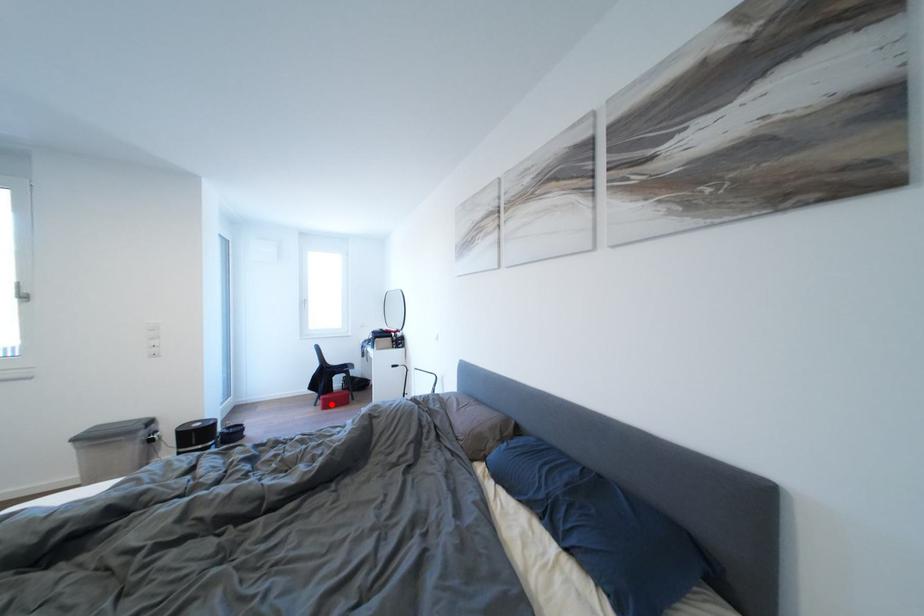
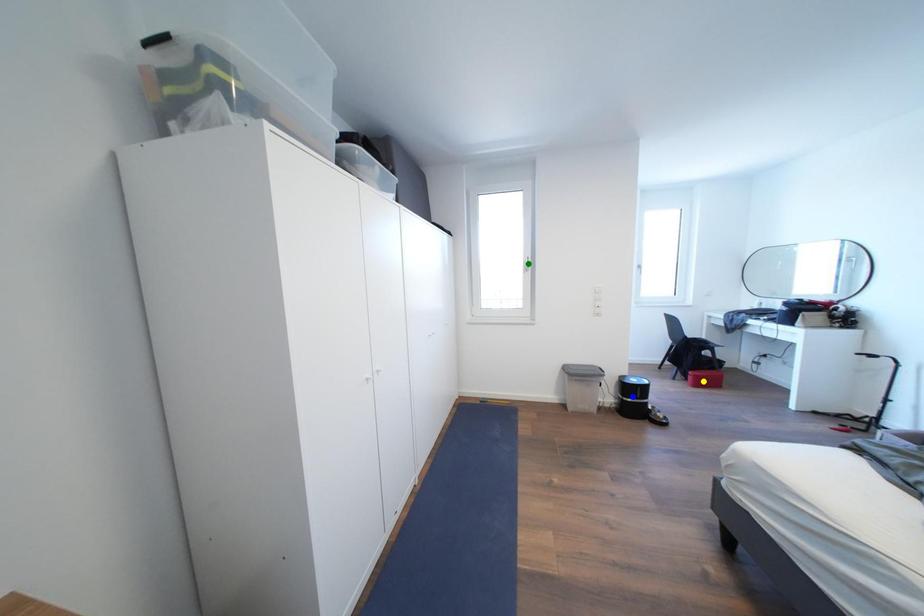
Question: I am providing you with two images of the same scene from different viewpoints. A red point is marked on the first image. You are given multiple points on the second image. Which mark in image 2 goes with the point in image 1?

Choices:
 (A) yellow point
 (B) green point
 (C) blue point

Answer: (A)